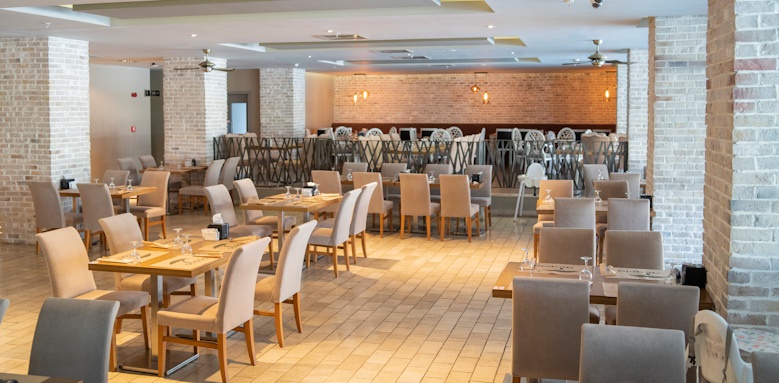
You are a GUI agent. You are given a task and a screenshot of the screen. Output one action in this format:
    pyautogui.click(x=<x>, y=<y>)
    Task: Click on the paper towel dispenser
    Image resolution: width=779 pixels, height=383 pixels.
    Given the screenshot: What is the action you would take?
    pyautogui.click(x=64, y=182), pyautogui.click(x=217, y=227), pyautogui.click(x=693, y=268), pyautogui.click(x=305, y=184), pyautogui.click(x=478, y=176), pyautogui.click(x=192, y=162)